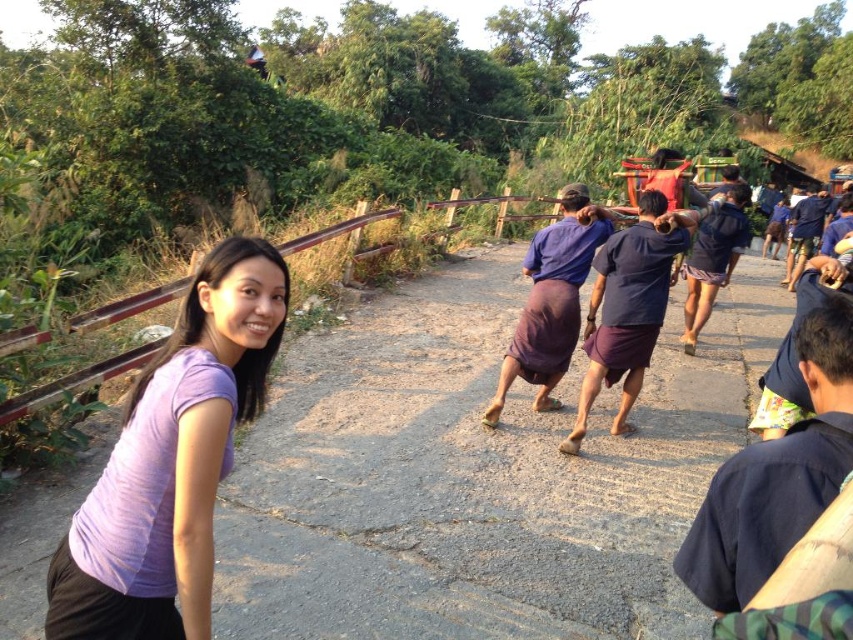
Question: Which object is closer to the camera taking this photo?

Choices:
 (A) purple matte shirt at lower left
 (B) purple cotton skirt at center
 (C) purple cotton shirt at center
 (D) purple fabric at center

Answer: (A)

Question: Is purple matte shirt at lower left to the left of purple cotton skirt at center from the viewer's perspective?

Choices:
 (A) no
 (B) yes

Answer: (B)

Question: Which point is farther to the camera?

Choices:
 (A) (560, 330)
 (B) (376, 584)
 (C) (277, 321)
 (D) (641, 275)

Answer: (A)

Question: Is purple fabric at center further to the viewer compared to purple cotton shirt at center?

Choices:
 (A) no
 (B) yes

Answer: (A)

Question: Can you confirm if purple matte shirt at lower left is thinner than purple cotton shirt at center?

Choices:
 (A) no
 (B) yes

Answer: (B)

Question: Which point appears farthest from the camera in this image?

Choices:
 (A) (500, 401)
 (B) (200, 621)
 (C) (491, 484)
 (D) (669, 212)

Answer: (A)